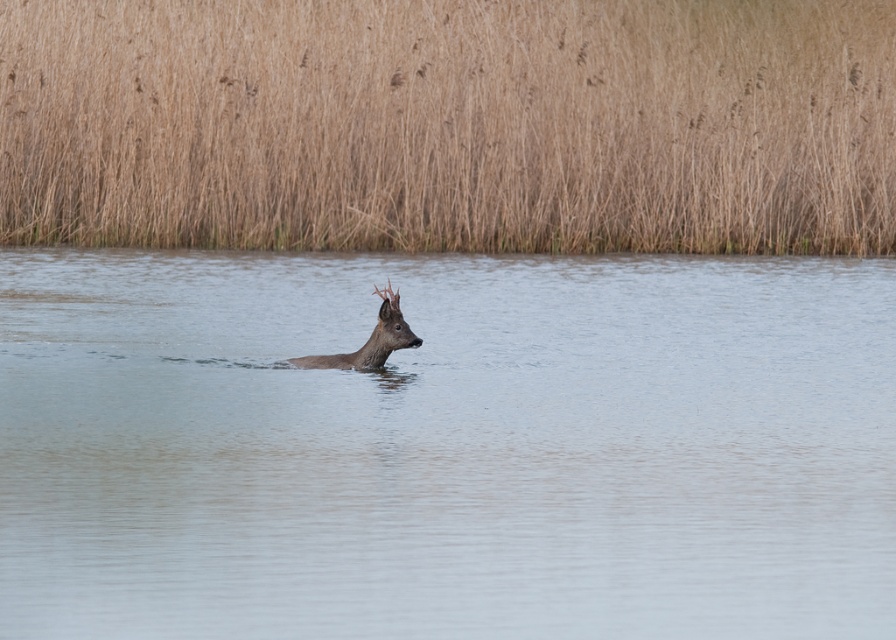
Question: Is brown grass at upper center wider than brown matte deer at center?

Choices:
 (A) yes
 (B) no

Answer: (A)

Question: Among these points, which one is farthest from the camera?

Choices:
 (A) (73, 74)
 (B) (392, 413)

Answer: (A)

Question: Is clear water at center closer to camera compared to brown grass at upper center?

Choices:
 (A) no
 (B) yes

Answer: (B)

Question: Is brown grass at upper center smaller than brown matte deer at center?

Choices:
 (A) yes
 (B) no

Answer: (B)

Question: Estimate the real-world distances between objects in this image. Which object is farther from the clear water at center?

Choices:
 (A) brown grass at upper center
 (B) brown matte deer at center

Answer: (A)

Question: Which point appears farthest from the camera in this image?

Choices:
 (A) (388, 97)
 (B) (858, 388)
 (C) (381, 342)

Answer: (A)